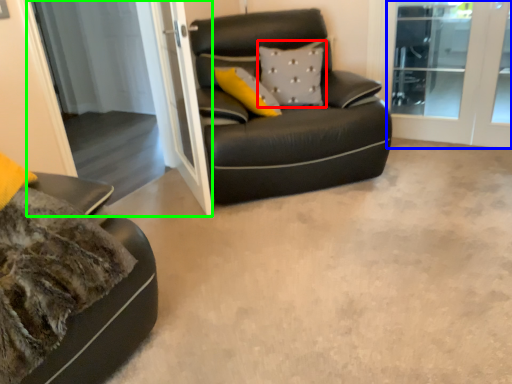
Question: Which object is the farthest from pillow (highlighted by a red box)? Choose among these: screen door (highlighted by a blue box) or screen door (highlighted by a green box).

Choices:
 (A) screen door
 (B) screen door

Answer: (A)